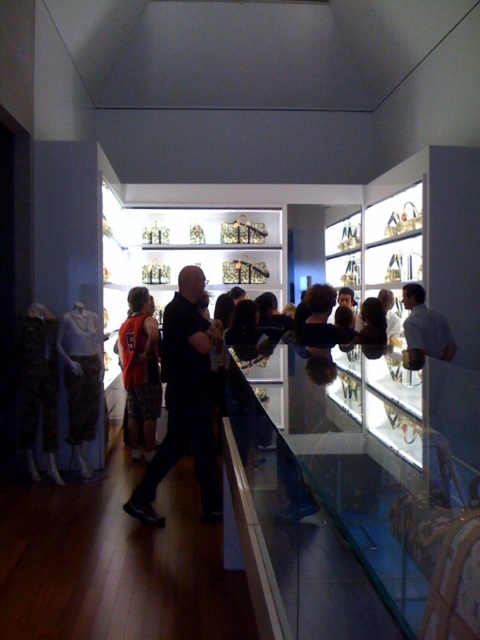
Question: Can you confirm if red plaid shorts at center is bigger than camouflage pants at left?

Choices:
 (A) yes
 (B) no

Answer: (A)

Question: Does black matte shirt at center appear on the right side of red plaid shorts at center?

Choices:
 (A) no
 (B) yes

Answer: (B)

Question: Does black matte shirt at center have a larger size compared to white matte shirt at center?

Choices:
 (A) no
 (B) yes

Answer: (B)

Question: Which point is closer to the camera?

Choices:
 (A) camouflage fabric pants at left
 (B) red plaid shorts at center
 (C) camouflage pants at left
 (D) black matte shirt at center

Answer: (D)

Question: Which object appears farthest from the camera in this image?

Choices:
 (A) camouflage fabric pants at left
 (B) transparent glass case at center
 (C) black matte shirt at center

Answer: (A)

Question: Estimate the real-world distances between objects in this image. Which object is closer to the black matte shirt at center?

Choices:
 (A) transparent glass case at center
 (B) camouflage fabric pants at left

Answer: (B)